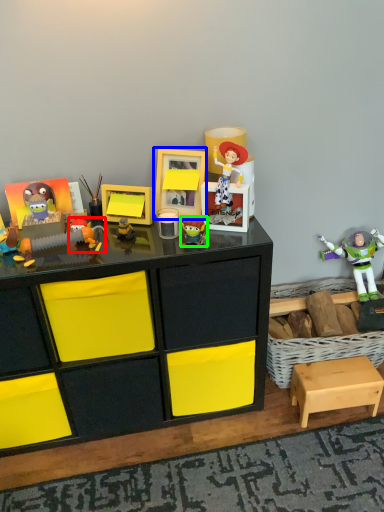
Question: Estimate the real-world distances between objects in this image. Which object is farther from toy (highlighted by a red box), picture frame (highlighted by a blue box) or toy (highlighted by a green box)?

Choices:
 (A) picture frame
 (B) toy

Answer: (B)